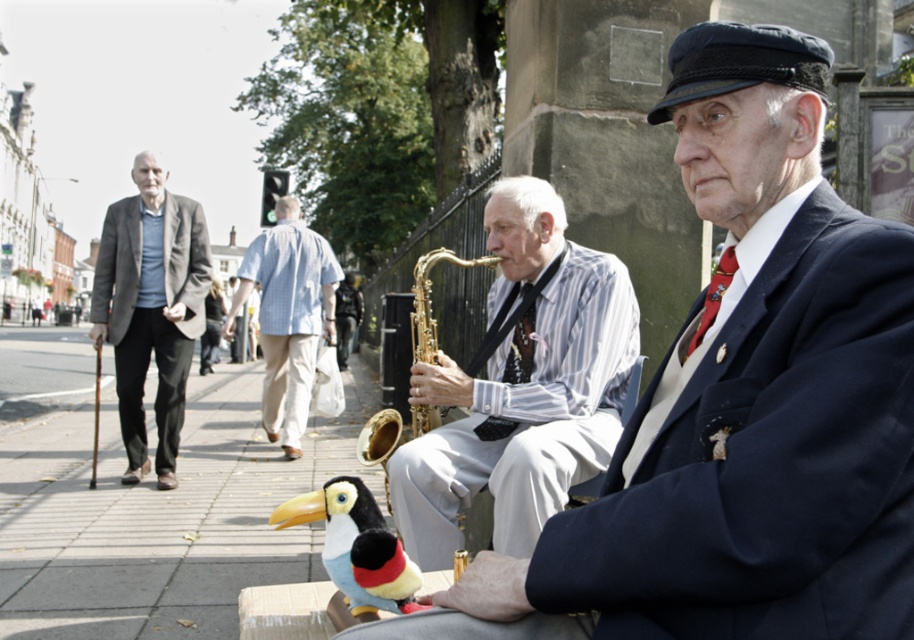
You are a photographer trying to capture a closeup of the matte black suit at center. Based on the coordinates provided in the Objects Description, where should you position your camera relative to the image frame?

The matte black suit at center is located at point coordinates 0.633 on the x axis and 0.812 on the y axis. To capture a closeup, position the camera so the center of the frame aligns with these coordinates.

You are a street performer who needs to place a gold brass saxophone at center and a wooden cane at left on a shelf that can only hold items narrower than 30 cm. Based on their widths, can both items fit on the shelf?

The gold brass saxophone at center has a width less than the wooden cane at left. Since the shelf can only hold items narrower than 30 cm, both items can fit only if both are under 30 cm. However, without knowing the exact width of the wooden cane at left, we cannot confirm if it is under 30 cm. Thus, it is uncertain if both will fit.

You are a photographer trying to capture a photo of the striped fabric shirt at center and the matte gray suit at left. Which object should you zoom in on to make them appear the same size in the photo?

The striped fabric shirt at center is smaller than the matte gray suit at left, so you should zoom in on the striped fabric shirt at center to make them appear the same size in the photo.